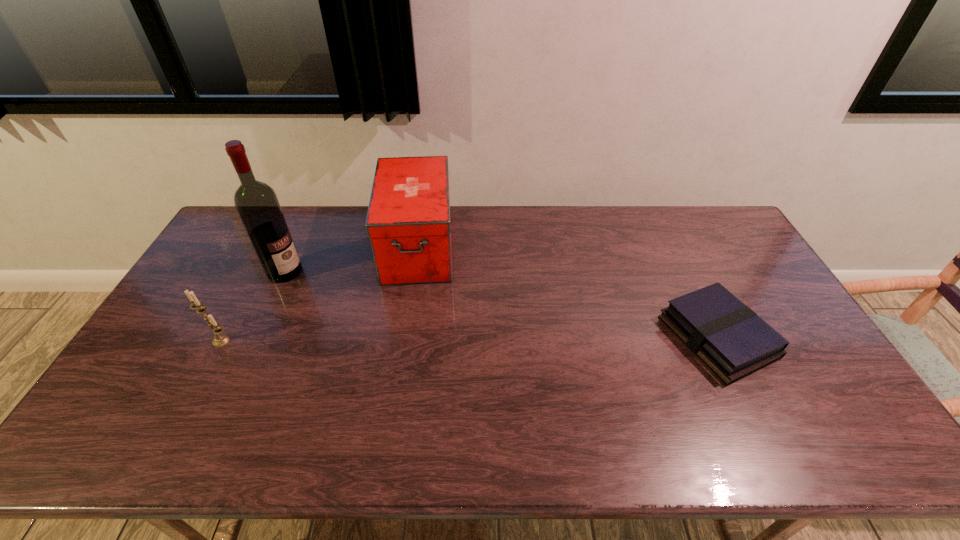
I want to click on vacant space on the desktop that is between the second shortest object and the rightmost object and is positioned on the handle side of the third shortest object, so click(414, 339).

At what (x,y) coordinates should I click in order to perform the action: click on vacant space on the desktop that is between the third tallest object and the rightmost object and is positioned on the front and back of the alcohol. Please return your answer as a coordinate pair (x, y). The image size is (960, 540). Looking at the image, I should click on (405, 339).